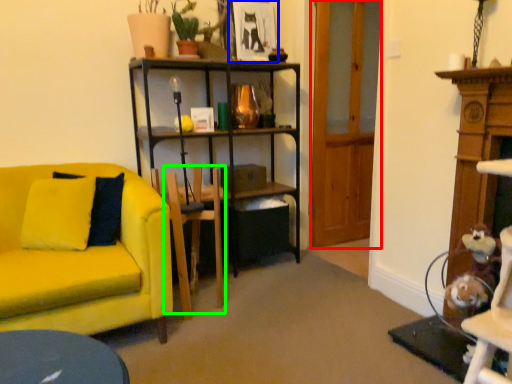
Question: Which object is positioned farthest from glass door (highlighted by a red box)? Select from picture frame (highlighted by a blue box) and swivel chair (highlighted by a green box).

Choices:
 (A) picture frame
 (B) swivel chair

Answer: (B)